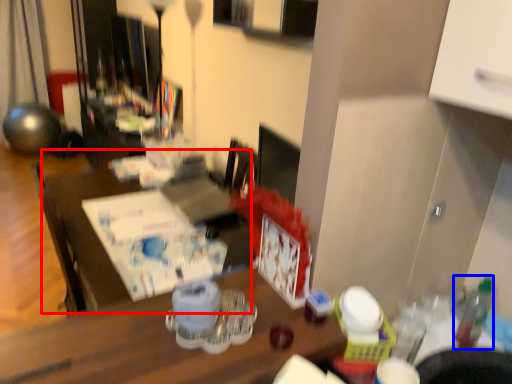
Question: Which point is closer to the camera, table (highlighted by a red box) or bottle (highlighted by a blue box)?

Choices:
 (A) table
 (B) bottle

Answer: (B)